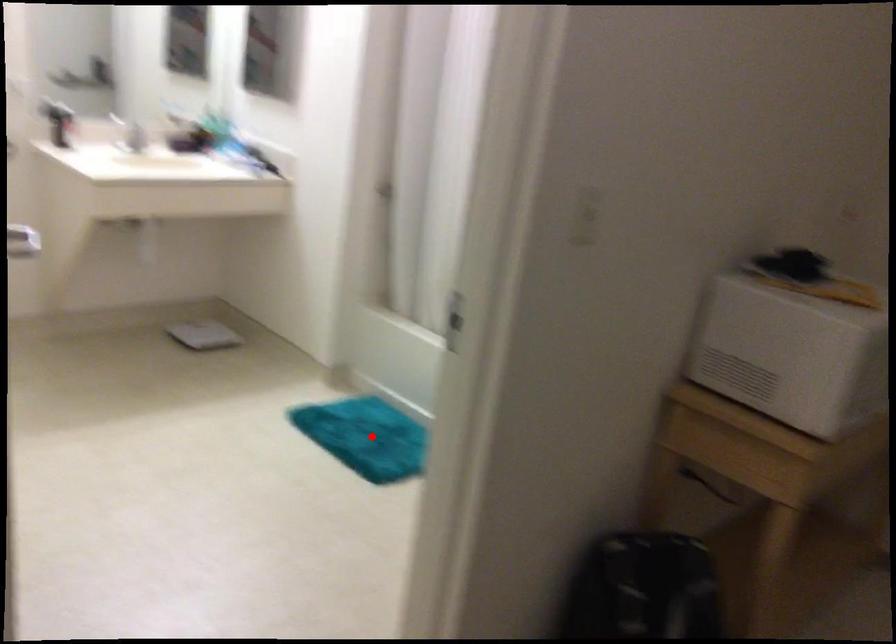
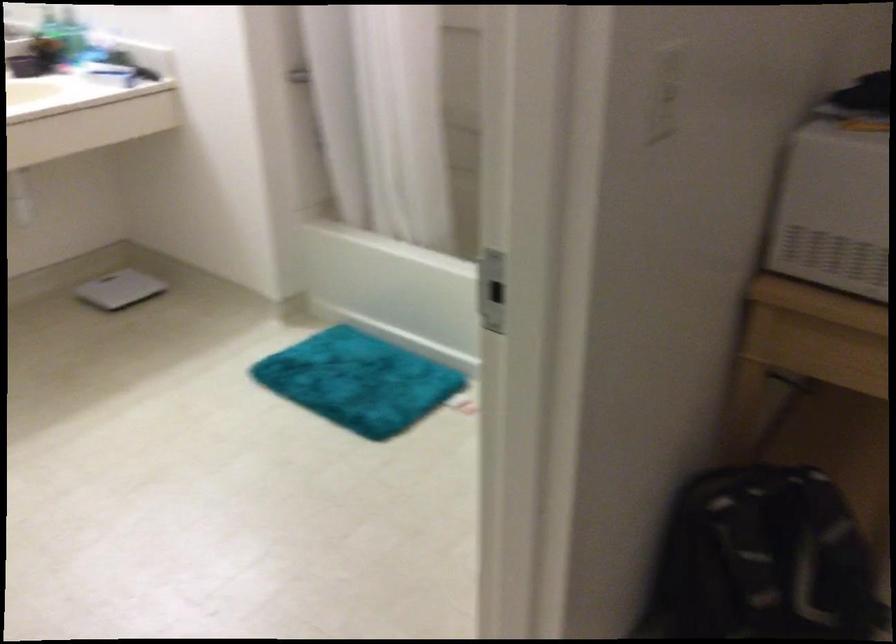
The point at the highlighted location is marked in the first image. Where is the corresponding point in the second image?

(358, 381)